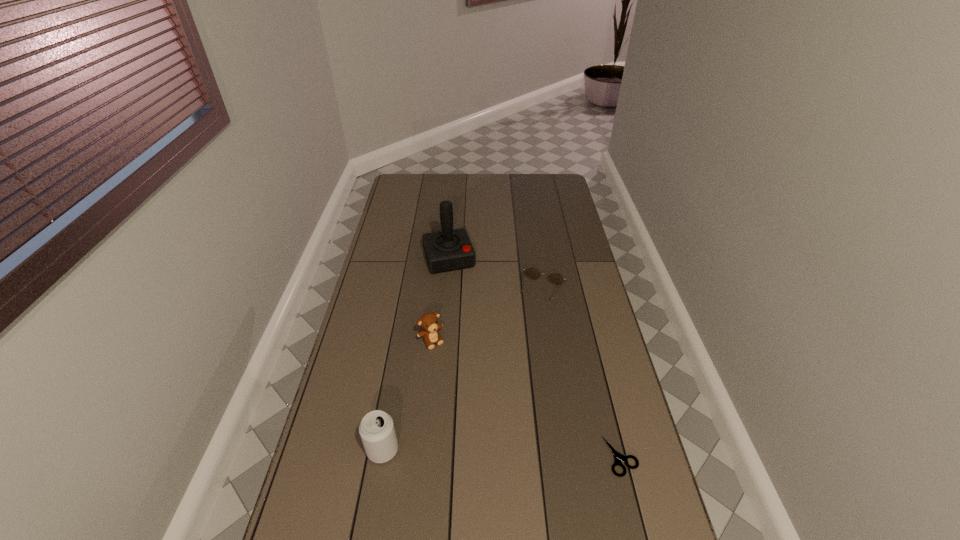
What are the coordinates of `vacant area that lies between the tallest object and the can` in the screenshot? It's located at (416, 354).

Image resolution: width=960 pixels, height=540 pixels. Identify the location of free space between the shears and the second object from right to left. (583, 374).

Identify the location of empty space that is in between the shortest object and the farthest object. This screenshot has height=540, width=960. (535, 357).

Find the location of a particular element. The height and width of the screenshot is (540, 960). vacant space in between the teddy bear and the tallest object is located at coordinates (440, 300).

Image resolution: width=960 pixels, height=540 pixels. Identify the location of vacant space in between the shears and the fourth nearest object. (583, 374).

Locate an element on the screen. Image resolution: width=960 pixels, height=540 pixels. empty space that is in between the can and the teddy bear is located at coordinates (407, 395).

What are the coordinates of `unoccupied area between the third tallest object and the second farthest object` in the screenshot? It's located at (488, 316).

Locate an element on the screen. free space between the farthest object and the fourth tallest object is located at coordinates (496, 275).

Locate an element on the screen. the closest object to the shortest object is located at coordinates (555, 278).

At what (x,y) coordinates should I click in order to perform the action: click on object that can be found as the closest to the fourth shortest object. Please return your answer as a coordinate pair (x, y). Looking at the image, I should click on (429, 321).